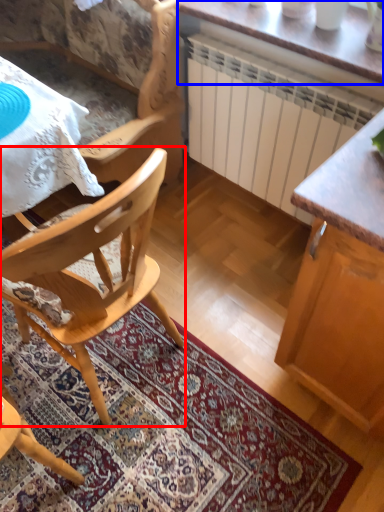
Question: Among these objects, which one is farthest to the camera, chair (highlighted by a red box) or table (highlighted by a blue box)?

Choices:
 (A) chair
 (B) table

Answer: (B)